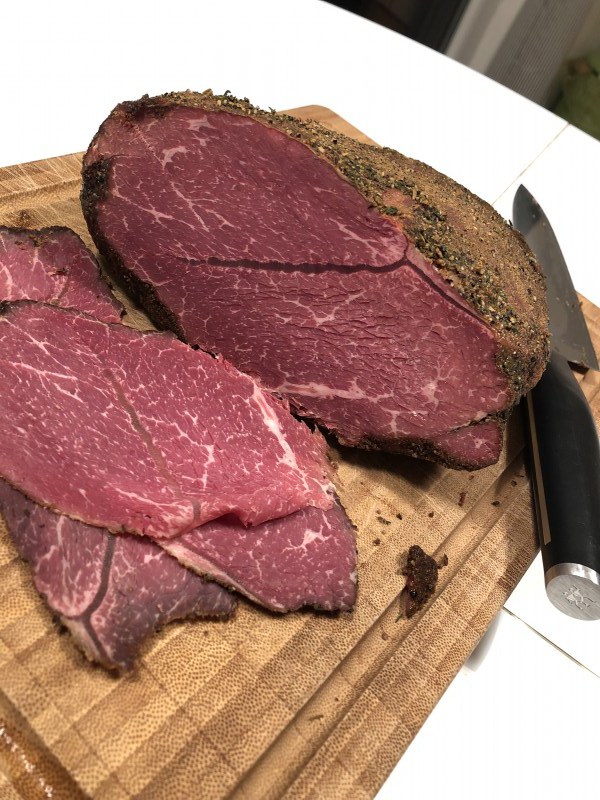
Identify the location of wall trim. This screenshot has height=800, width=600. (590, 650).